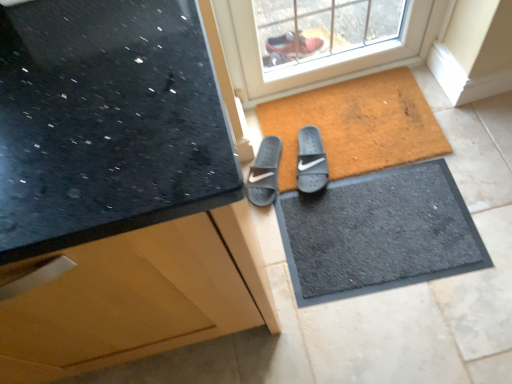
This screenshot has height=384, width=512. What are the coordinates of `vacant area that lies to the right of gray rubber slide at center, which is the 1th footwear in left-to-right order` in the screenshot? It's located at (327, 152).